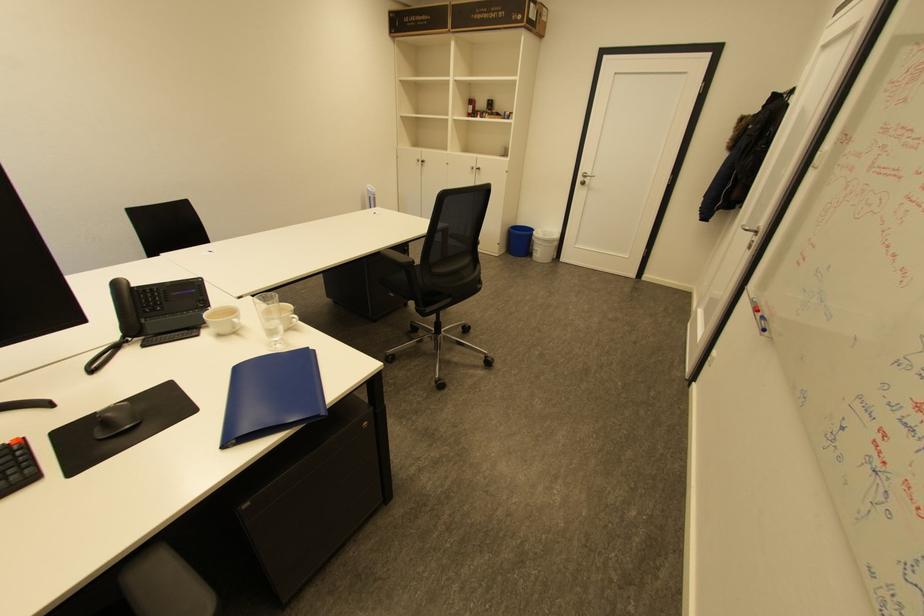
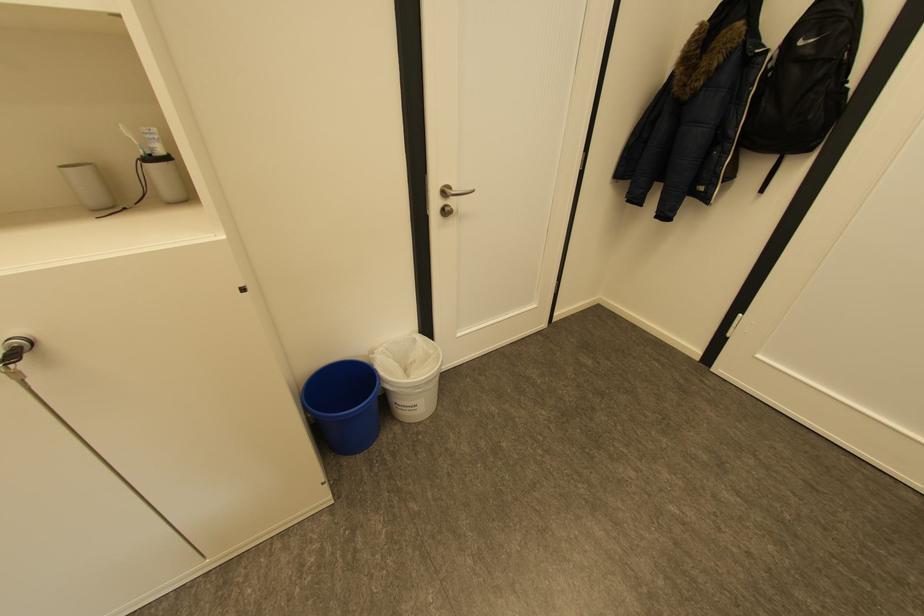
Locate, in the second image, the point that corresponds to the point at 551,232 in the first image.

(394, 349)